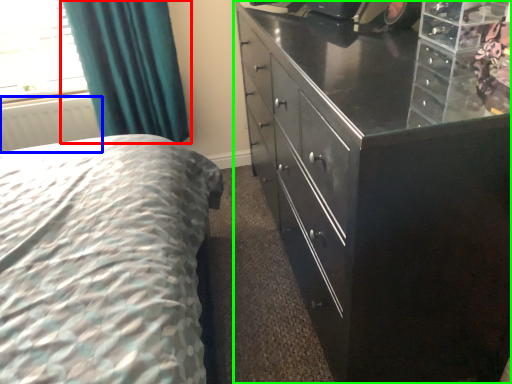
Question: Which object is positioned farthest from curtain (highlighted by a red box)? Select from radiator (highlighted by a blue box) and chest of drawers (highlighted by a green box).

Choices:
 (A) radiator
 (B) chest of drawers

Answer: (B)